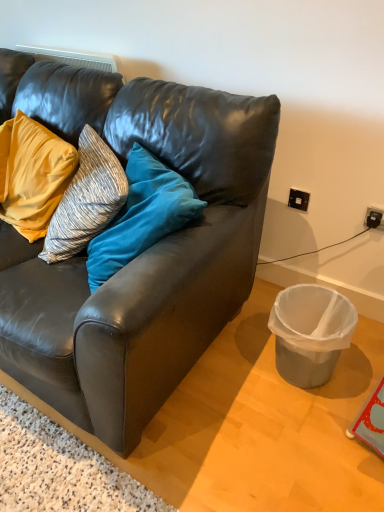
This screenshot has height=512, width=384. What do you see at coordinates (139, 256) in the screenshot? I see `matte black couch at center` at bounding box center [139, 256].

At what (x,y) coordinates should I click in order to perform the action: click on black plastic power outlet at upper right, marked as the first power outlet in a top-to-bottom arrangement. Please return your answer as a coordinate pair (x, y). Looking at the image, I should click on (298, 199).

Locate an element on the screen. The width and height of the screenshot is (384, 512). matte yellow pillow at upper left is located at coordinates (32, 174).

The image size is (384, 512). I want to click on metallic gray trash can at lower right, so click(x=310, y=332).

Is point (318, 347) closer or farther from the camera than point (372, 220)?

Clearly, point (318, 347) is closer to the camera than point (372, 220).

Looking at this image, from the image's perspective, does metallic gray trash can at lower right appear lower than black plastic power outlet at upper right, the 2th power outlet viewed from the left?

Yes, from the image's perspective, metallic gray trash can at lower right is below black plastic power outlet at upper right, the 2th power outlet viewed from the left.

Consider the image. Is metallic gray trash can at lower right in front of or behind black plastic power outlet at upper right, the 2th power outlet viewed from the left, in the image?

metallic gray trash can at lower right is positioned closer to the viewer than black plastic power outlet at upper right, the 2th power outlet viewed from the left.

Would you say matte black couch at center is inside or outside metallic gray trash can at lower right?

The correct answer is: outside.

Is matte black couch at center shorter than metallic gray trash can at lower right?

In fact, matte black couch at center may be taller than metallic gray trash can at lower right.

From a real-world perspective, relative to metallic gray trash can at lower right, is matte black couch at center vertically above or below?

matte black couch at center is above metallic gray trash can at lower right.

In the scene shown: What's the angular difference between matte black couch at center and metallic gray trash can at lower right's facing directions?

They differ by 0.409 degrees in their facing directions.

Can you confirm if black plastic power outlet at upper right, marked as the first power outlet in a top-to-bottom arrangement, is thinner than matte yellow pillow at upper left?

Correct, the width of black plastic power outlet at upper right, marked as the first power outlet in a top-to-bottom arrangement, is less than that of matte yellow pillow at upper left.

Does black plastic power outlet at upper right, marked as the first power outlet in a top-to-bottom arrangement, have a larger size compared to matte yellow pillow at upper left?

Actually, black plastic power outlet at upper right, marked as the first power outlet in a top-to-bottom arrangement, might be smaller than matte yellow pillow at upper left.

Considering the relative positions of black plastic power outlet at upper right, the second power outlet positioned from the bottom, and matte yellow pillow at upper left in the image provided, is black plastic power outlet at upper right, the second power outlet positioned from the bottom, to the right of matte yellow pillow at upper left from the viewer's perspective?

Yes.

Does matte black couch at center have a greater height compared to matte yellow pillow at upper left?

Yes.

Is point (234, 225) closer or farther from the camera than point (34, 146)?

Point (234, 225).

In the scene shown: Considering the positions of objects matte black couch at center and matte yellow pillow at upper left in the image provided, who is behind, matte black couch at center or matte yellow pillow at upper left?

Positioned behind is matte yellow pillow at upper left.

Considering the positions of point (301, 291) and point (306, 194), is point (301, 291) closer or farther from the camera than point (306, 194)?

Point (301, 291) appears to be closer to the viewer than point (306, 194).

From a real-world perspective, which is physically above, metallic gray trash can at lower right or black plastic power outlet at upper right, which is the 2th power outlet in right-to-left order?

black plastic power outlet at upper right, which is the 2th power outlet in right-to-left order, from a real-world perspective.

Is metallic gray trash can at lower right not close to black plastic power outlet at upper right, which is the 2th power outlet in right-to-left order?

metallic gray trash can at lower right is actually quite close to black plastic power outlet at upper right, which is the 2th power outlet in right-to-left order.

From their relative heights in the image, would you say metallic gray trash can at lower right is taller or shorter than black plastic power outlet at upper right, which is the second power outlet from front to back?

Clearly, metallic gray trash can at lower right is taller compared to black plastic power outlet at upper right, which is the second power outlet from front to back.

Measure the distance from matte black couch at center to black plastic power outlet at upper right, the second power outlet positioned from the bottom.

matte black couch at center and black plastic power outlet at upper right, the second power outlet positioned from the bottom, are 81.11 centimeters apart from each other.

Considering the sizes of matte black couch at center and black plastic power outlet at upper right, marked as the first power outlet in a top-to-bottom arrangement, in the image, is matte black couch at center taller or shorter than black plastic power outlet at upper right, marked as the first power outlet in a top-to-bottom arrangement,?

Clearly, matte black couch at center is taller compared to black plastic power outlet at upper right, marked as the first power outlet in a top-to-bottom arrangement.

At what (x,y) coordinates should I click in order to perform the action: click on studio couch that appears on the left of black plastic power outlet at upper right, which is the 2th power outlet in right-to-left order. Please return your answer as a coordinate pair (x, y). The width and height of the screenshot is (384, 512). Looking at the image, I should click on (139, 256).

From a real-world perspective, does black plastic power outlet at upper right, which is the 1th power outlet in front-to-back order, sit lower than matte yellow pillow at upper left?

Yes, from a real-world perspective, black plastic power outlet at upper right, which is the 1th power outlet in front-to-back order, is beneath matte yellow pillow at upper left.

In the scene shown: In the image, is black plastic power outlet at upper right, the 1th power outlet positioned from the right, on the left side or the right side of matte yellow pillow at upper left?

In the image, black plastic power outlet at upper right, the 1th power outlet positioned from the right, appears on the right side of matte yellow pillow at upper left.

Looking at this image, in terms of size, does black plastic power outlet at upper right, the 1th power outlet positioned from the right, appear bigger or smaller than matte yellow pillow at upper left?

In the image, black plastic power outlet at upper right, the 1th power outlet positioned from the right, appears to be smaller than matte yellow pillow at upper left.

What are the coordinates of `pillow on the left of black plastic power outlet at upper right, the 2th power outlet in the top-to-bottom sequence` in the screenshot? It's located at click(32, 174).

At what (x,y) coordinates should I click in order to perform the action: click on the 1st power outlet located above the metallic gray trash can at lower right (from a real-world perspective). Please return your answer as a coordinate pair (x, y). Looking at the image, I should click on (374, 218).

In the image, there is a matte black couch at center. In order to click on trash bin/can below it (from the image's perspective) in this screenshot , I will do `click(310, 332)`.

Based on the photo, considering their positions, is black plastic power outlet at upper right, which is the 1th power outlet in front-to-back order, positioned closer to black plastic power outlet at upper right, arranged as the first power outlet when viewed from the back, than metallic gray trash can at lower right?

The object closer to black plastic power outlet at upper right, arranged as the first power outlet when viewed from the back, is black plastic power outlet at upper right, which is the 1th power outlet in front-to-back order.

From the image, which object appears to be nearer to matte black couch at center, metallic gray trash can at lower right or black plastic power outlet at upper right, arranged as the first power outlet when viewed from the back?

The object closer to matte black couch at center is metallic gray trash can at lower right.

When comparing their distances from matte black couch at center, does black plastic power outlet at upper right, which is the second power outlet from front to back, or black plastic power outlet at upper right, which is the 1th power outlet in front-to-back order, seem further?

black plastic power outlet at upper right, which is the 1th power outlet in front-to-back order, is further to matte black couch at center.

Looking at the image, which one is located further to black plastic power outlet at upper right, which is the 2th power outlet in right-to-left order, metallic gray trash can at lower right or matte yellow pillow at upper left?

Among the two, matte yellow pillow at upper left is located further to black plastic power outlet at upper right, which is the 2th power outlet in right-to-left order.

When comparing their distances from matte black couch at center, does metallic gray trash can at lower right or black plastic power outlet at upper right, the 2th power outlet in the top-to-bottom sequence, seem further?

black plastic power outlet at upper right, the 2th power outlet in the top-to-bottom sequence, is further to matte black couch at center.

From the image, which object appears to be nearer to matte black couch at center, black plastic power outlet at upper right, which is the 1th power outlet in front-to-back order, or black plastic power outlet at upper right, marked as the first power outlet in a top-to-bottom arrangement?

black plastic power outlet at upper right, marked as the first power outlet in a top-to-bottom arrangement, is closer to matte black couch at center.

Based on their spatial positions, is matte black couch at center or black plastic power outlet at upper right, which is the second power outlet from front to back, closer to metallic gray trash can at lower right?

black plastic power outlet at upper right, which is the second power outlet from front to back.

Looking at the image, which one is located closer to matte yellow pillow at upper left, matte black couch at center or metallic gray trash can at lower right?

Among the two, matte black couch at center is located nearer to matte yellow pillow at upper left.

Locate an element on the screen. This screenshot has height=512, width=384. power outlet between matte yellow pillow at upper left and black plastic power outlet at upper right, the 1th power outlet positioned from the right is located at coordinates (298, 199).

This screenshot has width=384, height=512. What are the coordinates of `trash bin/can situated between matte yellow pillow at upper left and black plastic power outlet at upper right, which ranks as the first power outlet in left-to-right order, from left to right` in the screenshot? It's located at (310, 332).

Locate an element on the screen. This screenshot has width=384, height=512. studio couch between matte yellow pillow at upper left and black plastic power outlet at upper right, marked as the first power outlet in a top-to-bottom arrangement is located at coordinates (139, 256).

The image size is (384, 512). Identify the location of trash bin/can between matte yellow pillow at upper left and black plastic power outlet at upper right, the 1th power outlet from the bottom, in the horizontal direction. (310, 332).